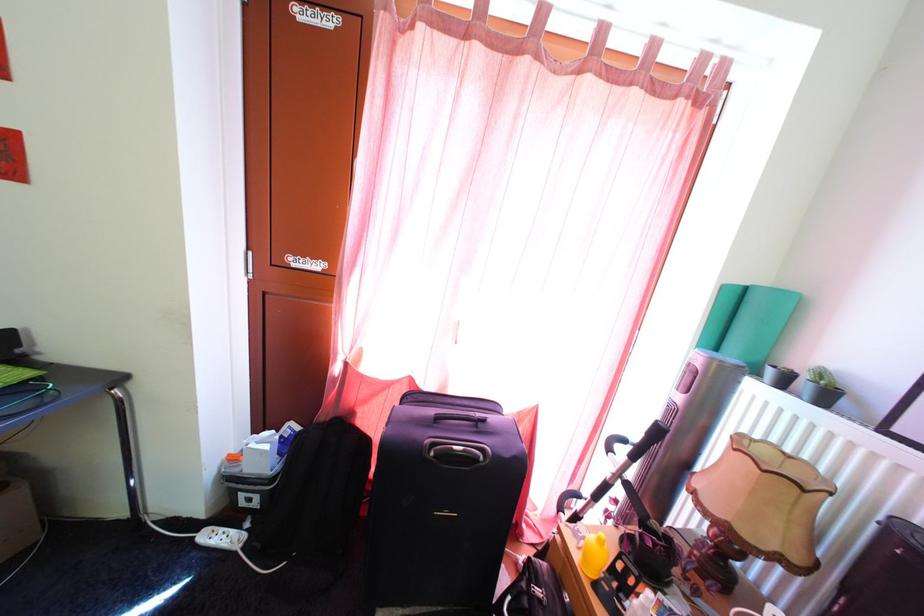
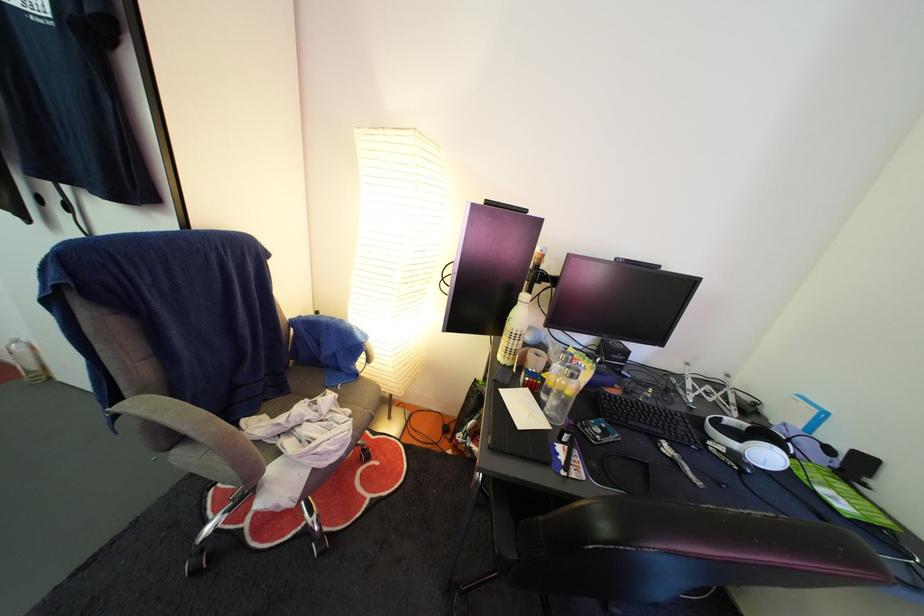
Question: The first image is from the beginning of the video and the second image is from the end. How did the camera likely rotate when shooting the video?

Choices:
 (A) Left
 (B) Right
 (C) Up
 (D) Down

Answer: (A)